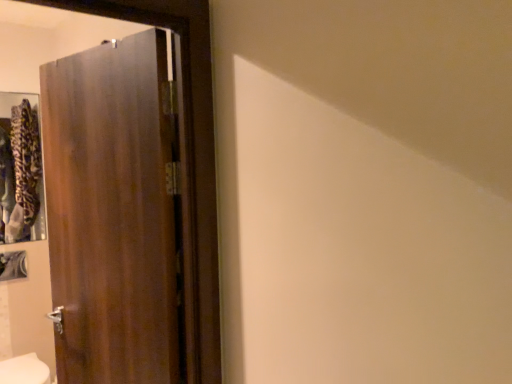
The image size is (512, 384). What do you see at coordinates (112, 212) in the screenshot? I see `dark wood door at left` at bounding box center [112, 212].

Locate an element on the screen. dark wood door at left is located at coordinates (112, 212).

The image size is (512, 384). What are the coordinates of `white glossy bidet at lower left` in the screenshot? It's located at (24, 370).

This screenshot has height=384, width=512. Describe the element at coordinates (24, 370) in the screenshot. I see `white glossy bidet at lower left` at that location.

Identify the location of dark wood door at left. Image resolution: width=512 pixels, height=384 pixels. (112, 212).

Between dark wood door at left and white glossy bidet at lower left, which one appears on the left side from the viewer's perspective?

From the viewer's perspective, white glossy bidet at lower left appears more on the left side.

Which is in front, dark wood door at left or white glossy bidet at lower left?

dark wood door at left is closer to the camera.

Does point (56, 354) appear closer or farther from the camera than point (18, 369)?

Point (56, 354).

From the image's perspective, between dark wood door at left and white glossy bidet at lower left, who is located below?

From the image's view, white glossy bidet at lower left is below.

From a real-world perspective, relative to white glossy bidet at lower left, is dark wood door at left vertically above or below?

In terms of real-world spatial position, dark wood door at left is above white glossy bidet at lower left.

Is dark wood door at left wider or thinner than white glossy bidet at lower left?

dark wood door at left is thinner than white glossy bidet at lower left.

Does dark wood door at left have a greater height compared to white glossy bidet at lower left?

Yes.

Between dark wood door at left and white glossy bidet at lower left, which one has smaller size?

Smaller between the two is white glossy bidet at lower left.

Can white glossy bidet at lower left be found inside dark wood door at left?

No, dark wood door at left does not contain white glossy bidet at lower left.

Is dark wood door at left far from white glossy bidet at lower left?

Indeed, dark wood door at left is not near white glossy bidet at lower left.

Does dark wood door at left turn towards white glossy bidet at lower left?

No, dark wood door at left does not turn towards white glossy bidet at lower left.

Measure the distance between dark wood door at left and white glossy bidet at lower left.

A distance of 1.42 meters exists between dark wood door at left and white glossy bidet at lower left.

The width and height of the screenshot is (512, 384). In order to click on bidet behind the dark wood door at left in this screenshot , I will do `click(24, 370)`.

Considering the positions of objects white glossy bidet at lower left and dark wood door at left in the image provided, who is more to the left, white glossy bidet at lower left or dark wood door at left?

white glossy bidet at lower left is more to the left.

Which object is more forward, white glossy bidet at lower left or dark wood door at left?

dark wood door at left is more forward.

Between point (17, 369) and point (151, 293), which one is positioned in front?

Positioned in front is point (151, 293).

From the image's perspective, which object appears higher, white glossy bidet at lower left or dark wood door at left?

From the image's view, dark wood door at left is above.

From a real-world perspective, does white glossy bidet at lower left sit lower than dark wood door at left?

Indeed, from a real-world perspective, white glossy bidet at lower left is positioned beneath dark wood door at left.

Which of these two, white glossy bidet at lower left or dark wood door at left, is wider?

With larger width is white glossy bidet at lower left.

Which of these two, white glossy bidet at lower left or dark wood door at left, stands taller?

Standing taller between the two is dark wood door at left.

From the picture: Can you confirm if white glossy bidet at lower left is smaller than dark wood door at left?

Yes.

Do you think white glossy bidet at lower left is within dark wood door at left, or outside of it?

The correct answer is: outside.

Are white glossy bidet at lower left and dark wood door at left far apart?

Indeed, white glossy bidet at lower left is not near dark wood door at left.

Is white glossy bidet at lower left oriented towards dark wood door at left?

No, white glossy bidet at lower left does not turn towards dark wood door at left.

Can you tell me how much white glossy bidet at lower left and dark wood door at left differ in facing direction?

72.5 degrees separate the facing orientations of white glossy bidet at lower left and dark wood door at left.

Locate an element on the screen. This screenshot has height=384, width=512. bidet behind the dark wood door at left is located at coordinates (24, 370).

You are a GUI agent. You are given a task and a screenshot of the screen. Output one action in this format:
    pyautogui.click(x=<x>, y=<y>)
    Task: Click on the door that is in front of the white glossy bidet at lower left
    
    Given the screenshot: What is the action you would take?
    pyautogui.click(x=112, y=212)

At what (x,y) coordinates should I click in order to perform the action: click on bidet below the dark wood door at left (from a real-world perspective). Please return your answer as a coordinate pair (x, y). This screenshot has width=512, height=384. Looking at the image, I should click on (24, 370).